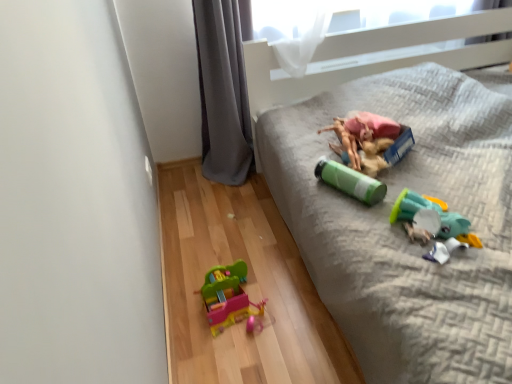
Question: From the image's perspective, is green matte water bottle at upper right on rubberized plastic toy at center, the first toy when ordered from top to bottom?

Choices:
 (A) no
 (B) yes

Answer: (A)

Question: Can you confirm if green matte water bottle at upper right is positioned to the right of rubberized plastic toy at center, the 4th toy in the bottom-to-top sequence?

Choices:
 (A) no
 (B) yes

Answer: (B)

Question: Is green matte water bottle at upper right touching rubberized plastic toy at center, the 4th toy in the bottom-to-top sequence?

Choices:
 (A) yes
 (B) no

Answer: (B)

Question: Is green matte water bottle at upper right facing towards rubberized plastic toy at center, the first toy when ordered from top to bottom?

Choices:
 (A) yes
 (B) no

Answer: (B)

Question: Is green matte water bottle at upper right facing away from rubberized plastic toy at center, the first toy when ordered from top to bottom?

Choices:
 (A) no
 (B) yes

Answer: (A)

Question: Is green matte water bottle at upper right at the left side of rubberized plastic toy at center, the first toy when ordered from top to bottom?

Choices:
 (A) yes
 (B) no

Answer: (B)

Question: Is gray fabric curtain at lower left positioned in front of translucent plastic toy at lower right, the third toy in the top-to-bottom sequence?

Choices:
 (A) yes
 (B) no

Answer: (B)

Question: Can you confirm if gray fabric curtain at lower left is smaller than translucent plastic toy at lower right, the third toy in the top-to-bottom sequence?

Choices:
 (A) no
 (B) yes

Answer: (A)

Question: Is gray fabric curtain at lower left oriented away from translucent plastic toy at lower right, the third toy in the top-to-bottom sequence?

Choices:
 (A) no
 (B) yes

Answer: (A)

Question: Can you confirm if gray fabric curtain at lower left is positioned to the left of translucent plastic toy at lower right, the third toy in the top-to-bottom sequence?

Choices:
 (A) no
 (B) yes

Answer: (B)

Question: From the image's perspective, would you say gray fabric curtain at lower left is shown under translucent plastic toy at lower right, the 2th toy ordered from the bottom?

Choices:
 (A) no
 (B) yes

Answer: (A)

Question: From the image's perspective, is gray fabric curtain at lower left on translucent plastic toy at lower right, the third toy in the top-to-bottom sequence?

Choices:
 (A) no
 (B) yes

Answer: (B)

Question: From a real-world perspective, is multicolored plastic toy at lower center, marked as the 1th toy in a bottom-to-top arrangement, under rubberized plastic toy at center, the first toy when ordered from top to bottom?

Choices:
 (A) yes
 (B) no

Answer: (A)